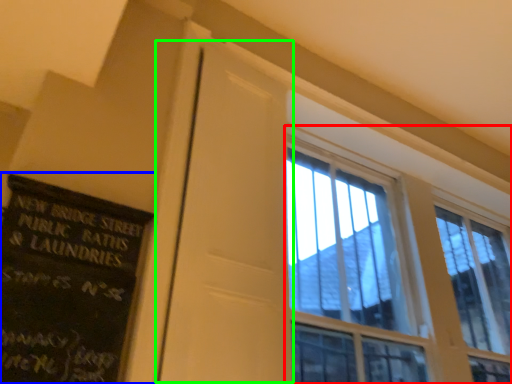
Question: Which object is the closest to the window (highlighted by a red box)? Choose among these: bulletin board (highlighted by a blue box) or screen door (highlighted by a green box).

Choices:
 (A) bulletin board
 (B) screen door

Answer: (B)